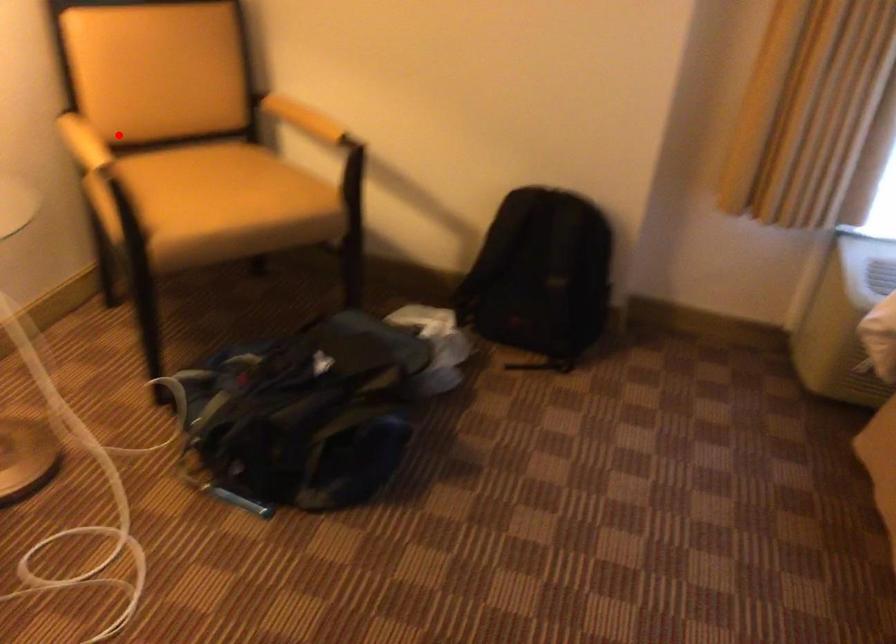
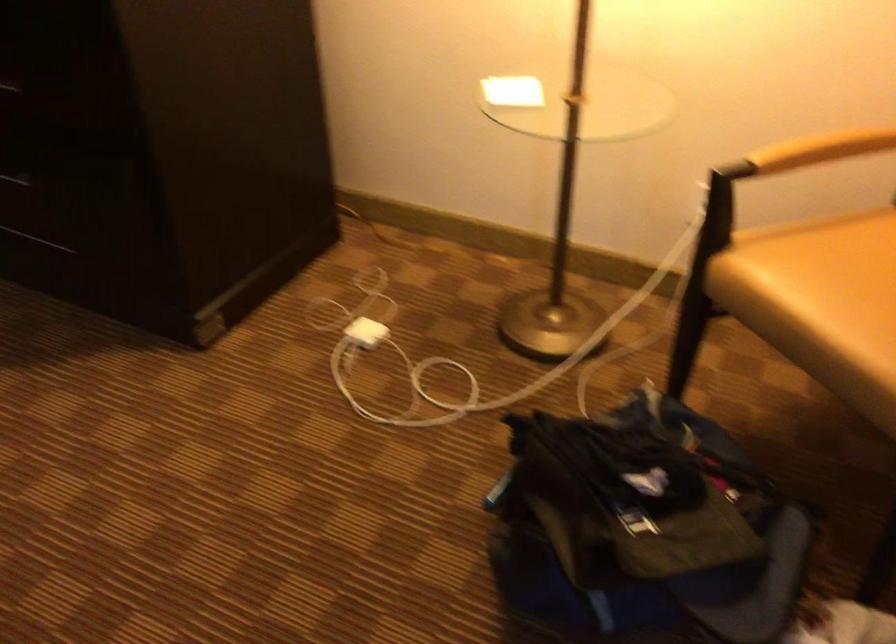
Question: I am providing you with two images of the same scene from different viewpoints. Given a red point in image1, look at the same physical point in image2. Is it:

Choices:
 (A) Closer to the viewpoint
 (B) Farther from the viewpoint

Answer: (A)